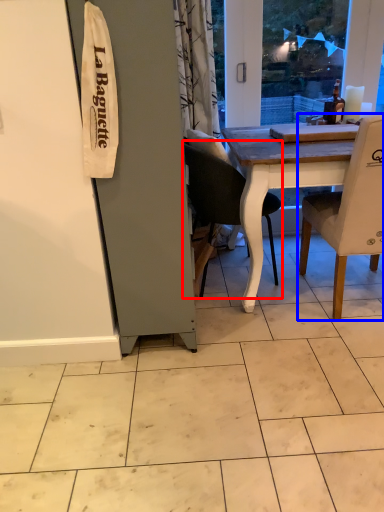
Question: Which of the following is the closest to the observer, chair (highlighted by a red box) or chair (highlighted by a blue box)?

Choices:
 (A) chair
 (B) chair

Answer: (B)